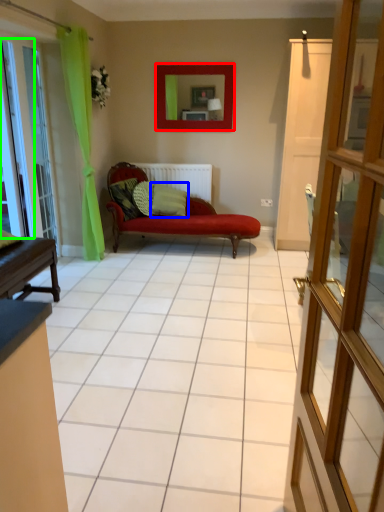
Question: Which is nearer to the picture frame (highlighted by a red box)? pillow (highlighted by a blue box) or window (highlighted by a green box).

Choices:
 (A) pillow
 (B) window

Answer: (A)